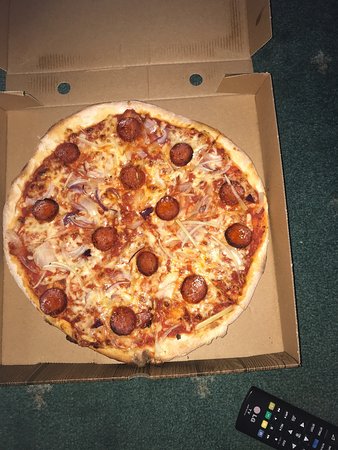
Find the location of `green carpet`. green carpet is located at coordinates (188, 428).